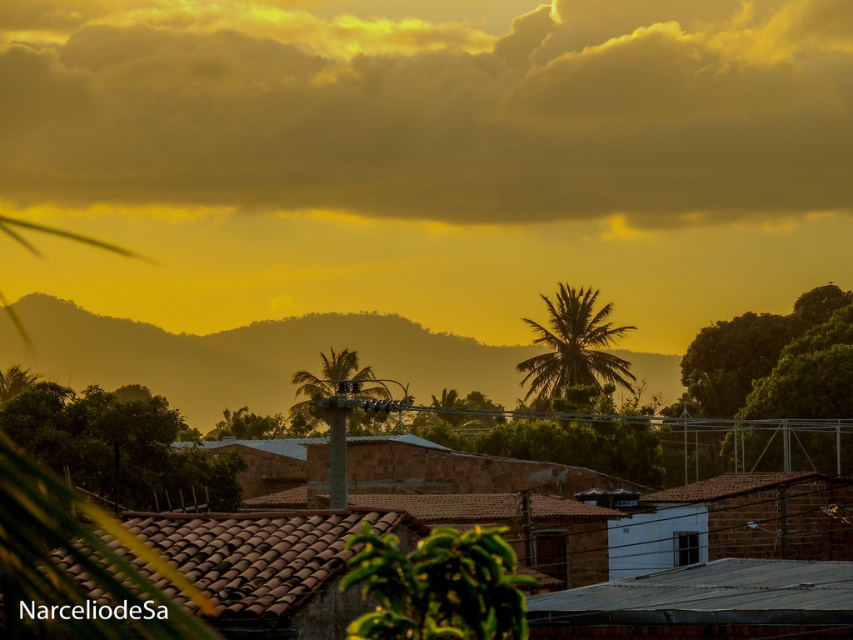
You are standing in a garden and looking at the cloudy textured sky at upper center and the green leafy palm tree at center. Which object is higher in the sky?

The cloudy textured sky at upper center is located above the green leafy palm tree at center, so it is higher in the sky.

You are standing in the residential area looking at the cloudy textured sky at upper center and the green leafy palm tree at center. Which object is positioned to the left of the other?

The cloudy textured sky at upper center is positioned to the left of the green leafy palm tree at center.

In the scene shown: You are a landscape architect designing a garden and want to plant both the green leafy palm at center and the green leafy palm tree at center. Which one should you plant first if you want the smaller one to grow around the larger one?

You should plant the green leafy palm tree at center first because the green leafy palm at center is smaller in size compared to the green leafy palm tree at center, allowing the smaller one to grow around the larger one.